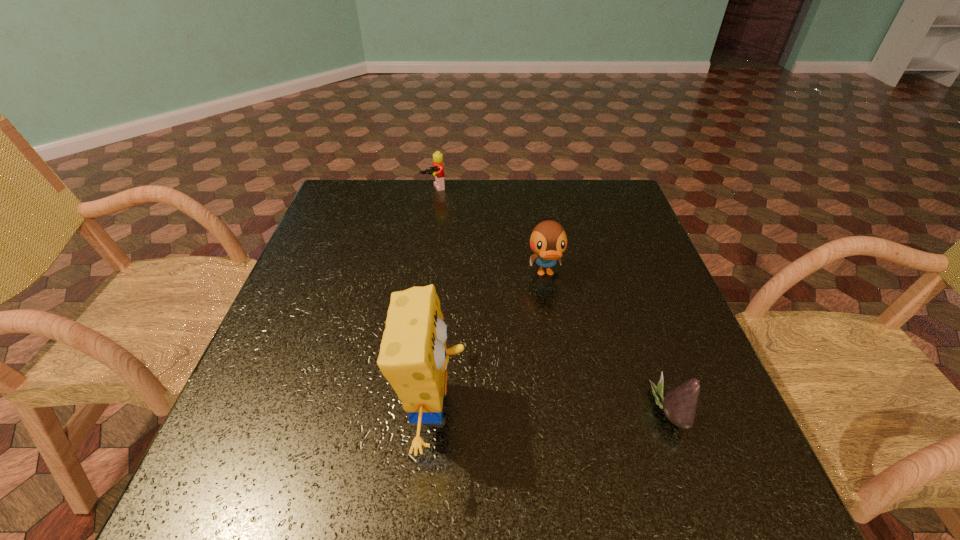
This screenshot has width=960, height=540. In order to click on empty space between the duck and the rightmost object in this screenshot , I will do `click(608, 342)`.

The image size is (960, 540). Identify the location of vacant space in between the Lego and the rightmost object. (552, 299).

Where is `object identified as the closest to the avocado`? object identified as the closest to the avocado is located at coordinates (548, 241).

Identify which object is located as the nearest to the avocado. Please provide its 2D coordinates. Your answer should be formatted as a tuple, i.e. [(x, y)], where the tuple contains the x and y coordinates of a point satisfying the conditions above.

[(548, 241)]

Locate an element on the screen. vacant space that satisfies the following two spatial constraints: 1. on the front side of the rightmost object; 2. on the seed side of the duck is located at coordinates (568, 410).

You are a GUI agent. You are given a task and a screenshot of the screen. Output one action in this format:
    pyautogui.click(x=<x>, y=<y>)
    Task: Click on the free space that satisfies the following two spatial constraints: 1. on the front side of the duck; 2. on the seed side of the rightmost object
    
    Given the screenshot: What is the action you would take?
    pyautogui.click(x=568, y=410)

Identify the location of free location that satisfies the following two spatial constraints: 1. on the front side of the Lego; 2. on the face of the tallest object. This screenshot has width=960, height=540. (401, 409).

This screenshot has width=960, height=540. What are the coordinates of `vacant region that satisfies the following two spatial constraints: 1. on the front side of the second tallest object; 2. on the seed side of the avocado` in the screenshot? It's located at (568, 410).